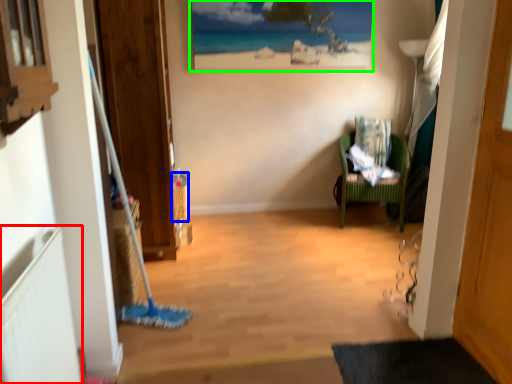
Question: Estimate the real-world distances between objects in this image. Which object is farther from radiator (highlighted by a red box), picnic basket (highlighted by a blue box) or picture frame (highlighted by a green box)?

Choices:
 (A) picnic basket
 (B) picture frame

Answer: (B)